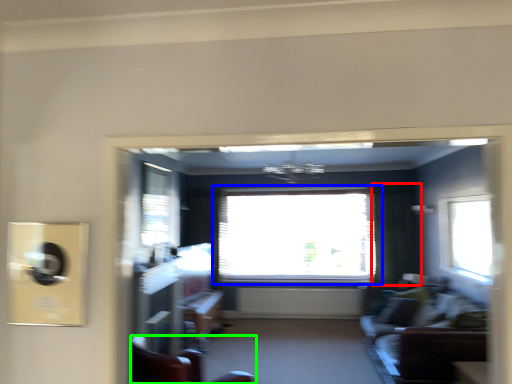
Question: Which object is the farthest from curtain (highlighted by a red box)? Choose among these: window (highlighted by a blue box) or furniture (highlighted by a green box).

Choices:
 (A) window
 (B) furniture

Answer: (B)